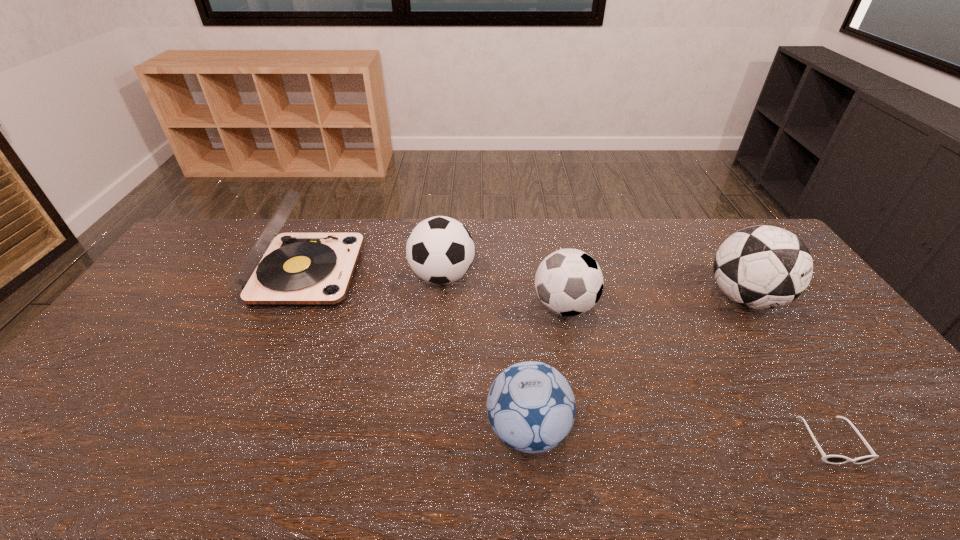
The height and width of the screenshot is (540, 960). In order to click on free space located 0.100m on the side with brand of the nearest soccer ball in this screenshot , I will do `click(444, 430)`.

Find the location of a particular element. The width and height of the screenshot is (960, 540). record player located in the far edge section of the desktop is located at coordinates (291, 269).

Image resolution: width=960 pixels, height=540 pixels. Identify the location of soccer ball at the far edge. (440, 250).

At what (x,y) coordinates should I click in order to perform the action: click on soccer ball located in the near edge section of the desktop. Please return your answer as a coordinate pair (x, y). Looking at the image, I should click on (531, 407).

Identify the location of sunglasses that is at the near edge. (831, 459).

The height and width of the screenshot is (540, 960). What are the coordinates of `object positioned at the right edge` in the screenshot? It's located at (762, 267).

I want to click on vacant space at the far edge of the desktop, so click(x=602, y=252).

In the image, there is a desktop. At what (x,y) coordinates should I click in order to perform the action: click on free space at the near edge. Please return your answer as a coordinate pair (x, y). Looking at the image, I should click on (646, 451).

Find the location of a particular element. The width and height of the screenshot is (960, 540). vacant area at the left edge of the desktop is located at coordinates (38, 436).

At what (x,y) coordinates should I click in order to perform the action: click on vacant space at the right edge of the desktop. Please return your answer as a coordinate pair (x, y). The height and width of the screenshot is (540, 960). Looking at the image, I should click on (847, 391).